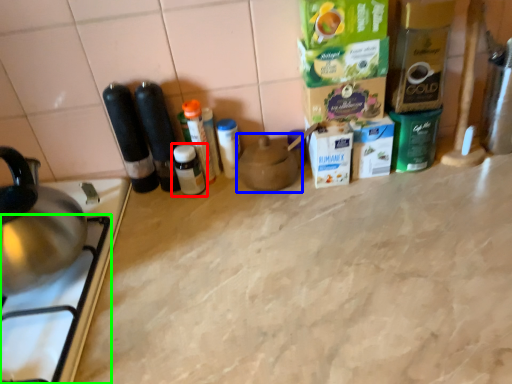
Question: Based on their relative distances, which object is farther from bottle (highlighted by a red box)? Choose from appliance (highlighted by a blue box) and gas stove (highlighted by a green box).

Choices:
 (A) appliance
 (B) gas stove

Answer: (B)